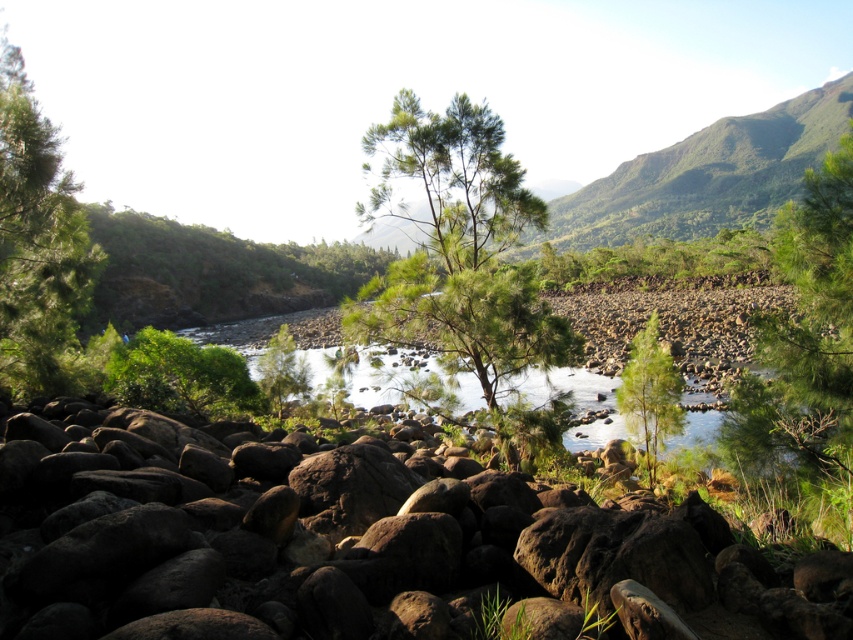
You are standing at the edge of the riverbed and want to take a photo of the green leafy tree at left. If your camera has a maximum zoom range of 10 meters, will you be able to capture the tree clearly without moving closer?

The green leafy tree at left is 12.21 meters away from the viewer. Since the camera can only zoom up to 10 meters, you won

You are standing in the middle of the rocky riverbed and want to walk towards the green matte tree at right. Which direction should you head to avoid the green matte tree at center?

The green matte tree at right is positioned on the right side of green matte tree at center, so to avoid the green matte tree at center, you should head to the right side of the green matte tree at center.

You are standing at point [805,339] in the image. What object is located at this point?

The green matte tree at right is located at point [805,339].